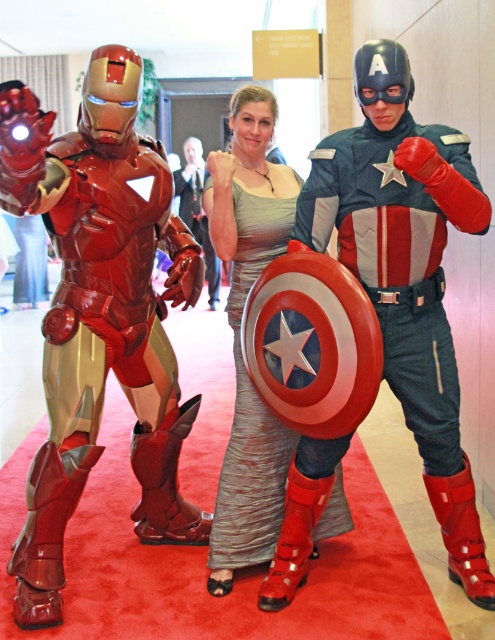
Who is positioned more to the right, shiny metallic armor at left or shiny metallic armor at center?

shiny metallic armor at left

Can you confirm if shiny metallic armor at left is taller than shiny metallic armor at center?

No, shiny metallic armor at left is not taller than shiny metallic armor at center.

Which is behind, point (166, 445) or point (214, 282)?

The point (214, 282) is behind.

The height and width of the screenshot is (640, 495). I want to click on shiny metallic armor at left, so click(99, 314).

Is shiny metallic shield at center thinner than shiny silver dress at center?

No, shiny metallic shield at center is not thinner than shiny silver dress at center.

Does shiny metallic shield at center have a lesser height compared to shiny silver dress at center?

Correct, shiny metallic shield at center is not as tall as shiny silver dress at center.

Is point (459, 180) less distant than point (246, 454)?

That is True.

Locate an element on the screen. shiny metallic shield at center is located at coordinates (406, 273).

In the scene shown: Is shiny metallic armor at left wider than shiny silver dress at center?

Correct, the width of shiny metallic armor at left exceeds that of shiny silver dress at center.

Does shiny metallic armor at left appear under shiny silver dress at center?

Yes, shiny metallic armor at left is below shiny silver dress at center.

Who is more distant from viewer, (177,528) or (271,518)?

The point (177,528) is more distant.

You are a GUI agent. You are given a task and a screenshot of the screen. Output one action in this format:
    pyautogui.click(x=<x>, y=<y>)
    Task: Click on the shiny metallic armor at left
    Image resolution: width=495 pixels, height=640 pixels.
    Given the screenshot: What is the action you would take?
    pyautogui.click(x=99, y=314)